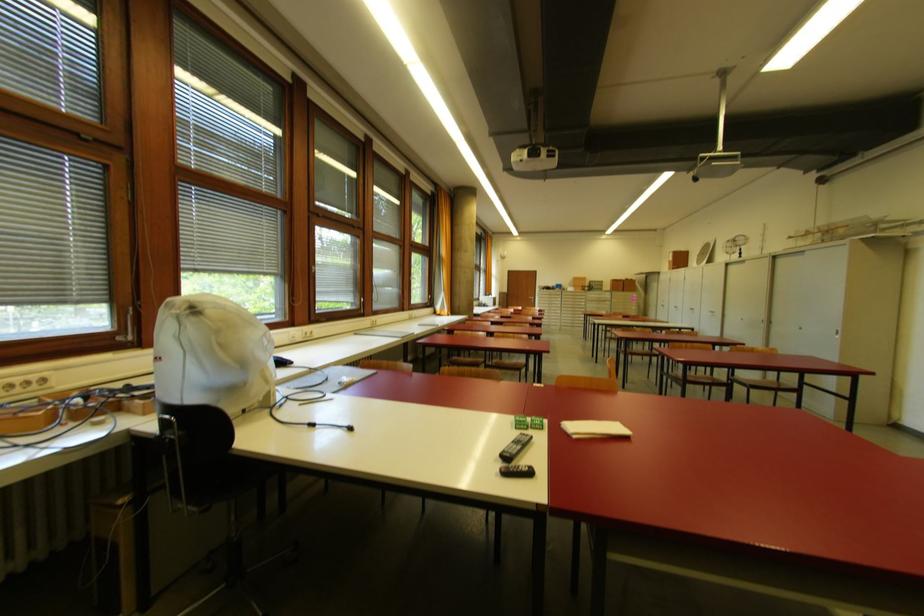
This screenshot has height=616, width=924. Describe the element at coordinates (360, 304) in the screenshot. I see `the cabinet door handle` at that location.